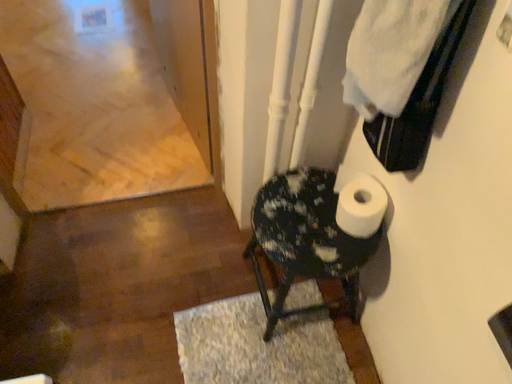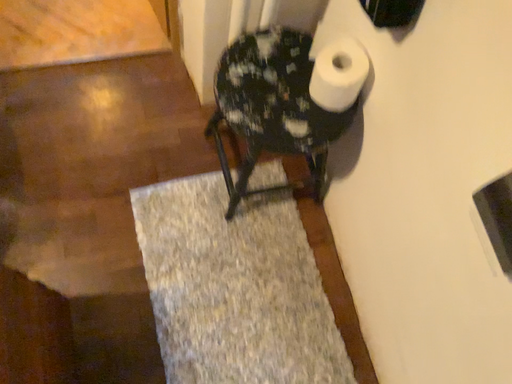
Question: Which way did the camera rotate in the video?

Choices:
 (A) rotated downward
 (B) rotated upward

Answer: (A)